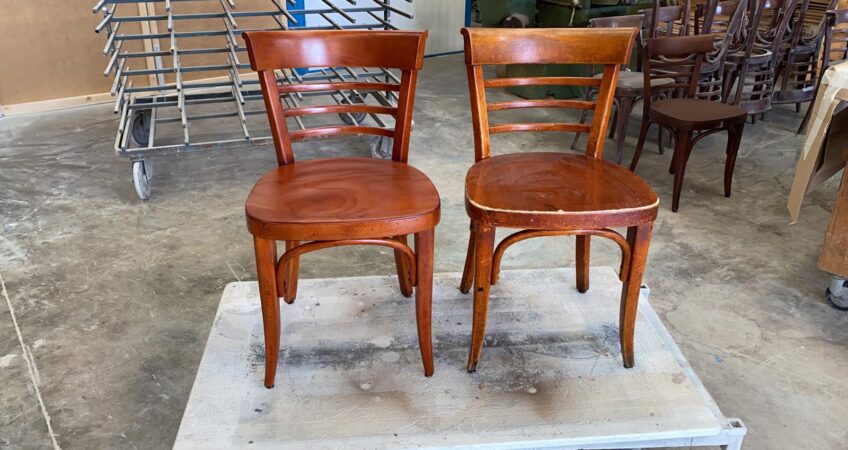
You are a GUI agent. You are given a task and a screenshot of the screen. Output one action in this format:
    pyautogui.click(x=<x>, y=<y>)
    Task: Click on the chair seats
    This screenshot has width=848, height=450.
    Given the screenshot: What is the action you would take?
    pyautogui.click(x=501, y=190), pyautogui.click(x=629, y=83), pyautogui.click(x=688, y=108), pyautogui.click(x=335, y=192), pyautogui.click(x=659, y=60)